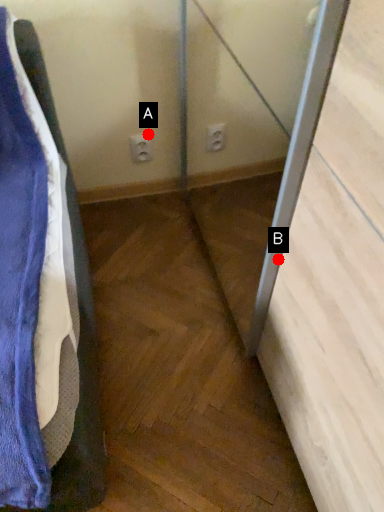
Question: Two points are circled on the image, labeled by A and B beside each circle. Among these points, which one is nearest to the camera?

Choices:
 (A) A is closer
 (B) B is closer

Answer: (B)